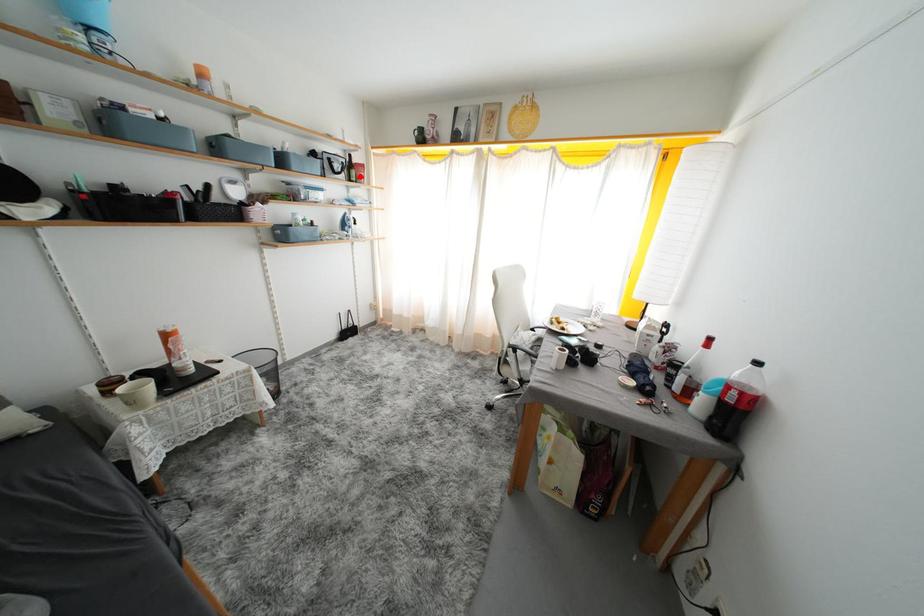
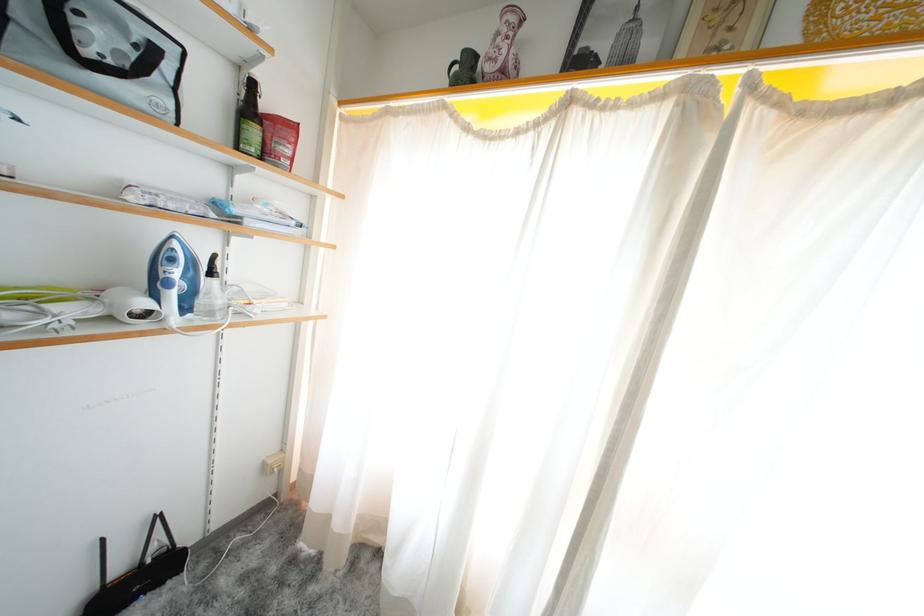
Question: A red point is marked in image1. In image2, is the corresponding 3D point closer to the camera or farther? Reply with the corresponding letter.

Choices:
 (A) The corresponding 3D point is closer.
 (B) The corresponding 3D point is farther.

Answer: (B)